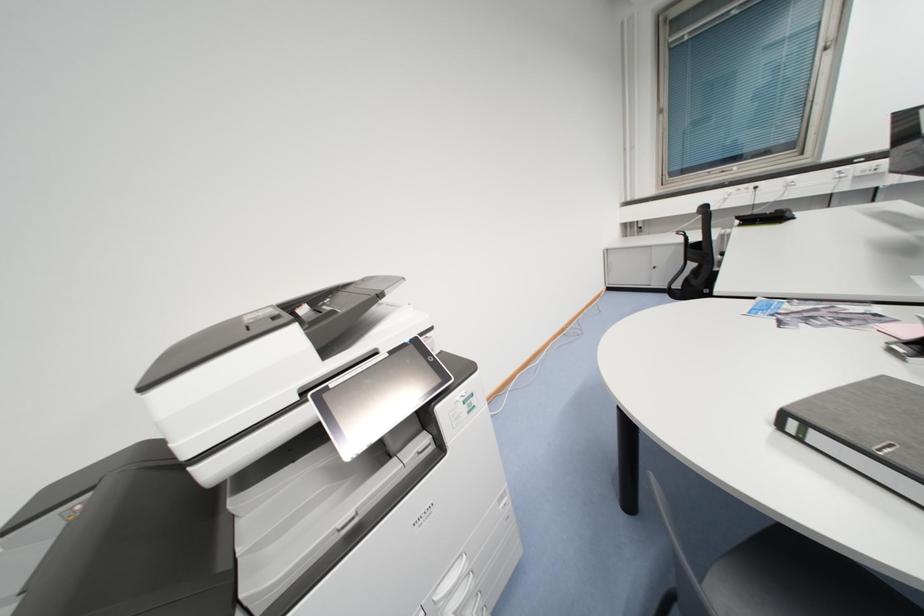
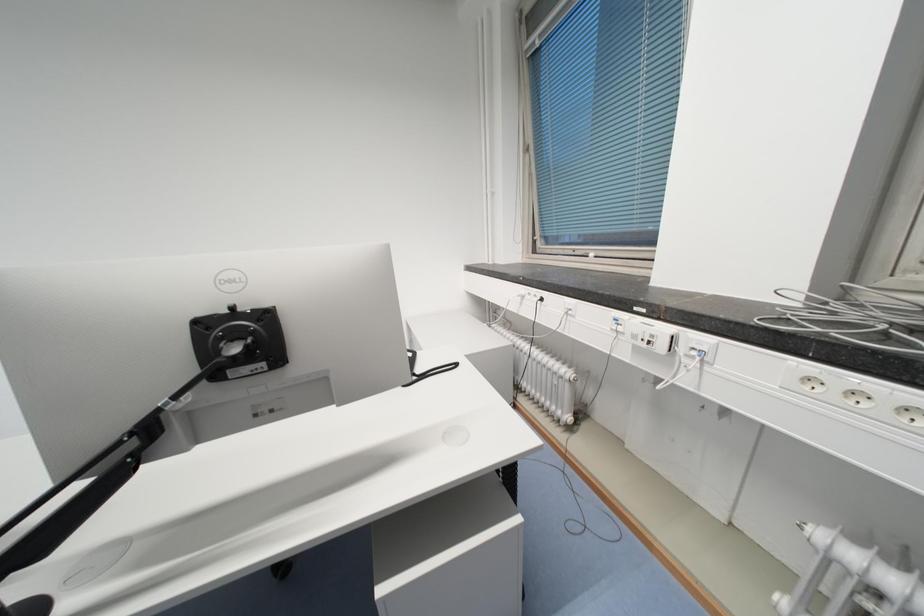
Question: In a continuous first-person perspective shot, in which direction is the camera moving?

Choices:
 (A) Left
 (B) Right
 (C) Forward
 (D) Backward

Answer: (B)